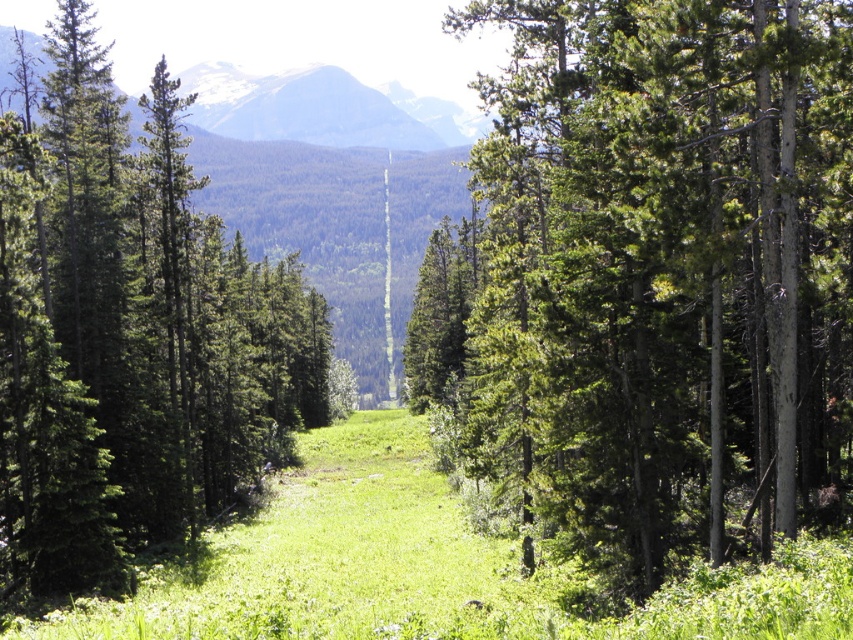
Is green matte tree at left shorter than green grassy at center?

Incorrect, green matte tree at left's height does not fall short of green grassy at center's.

Describe the element at coordinates (129, 332) in the screenshot. I see `green matte tree at left` at that location.

The width and height of the screenshot is (853, 640). Find the location of `green matte tree at left`. green matte tree at left is located at coordinates (129, 332).

In order to click on green textured tree at center in this screenshot , I will do `click(654, 276)`.

The width and height of the screenshot is (853, 640). I want to click on green textured tree at center, so click(654, 276).

Does green textured tree at center appear over green grassy at center?

Indeed, green textured tree at center is positioned over green grassy at center.

Can you confirm if green textured tree at center is bigger than green grassy at center?

Indeed, green textured tree at center has a larger size compared to green grassy at center.

Locate an element on the screen. This screenshot has height=640, width=853. green textured tree at center is located at coordinates (654, 276).

I want to click on green textured tree at center, so click(654, 276).